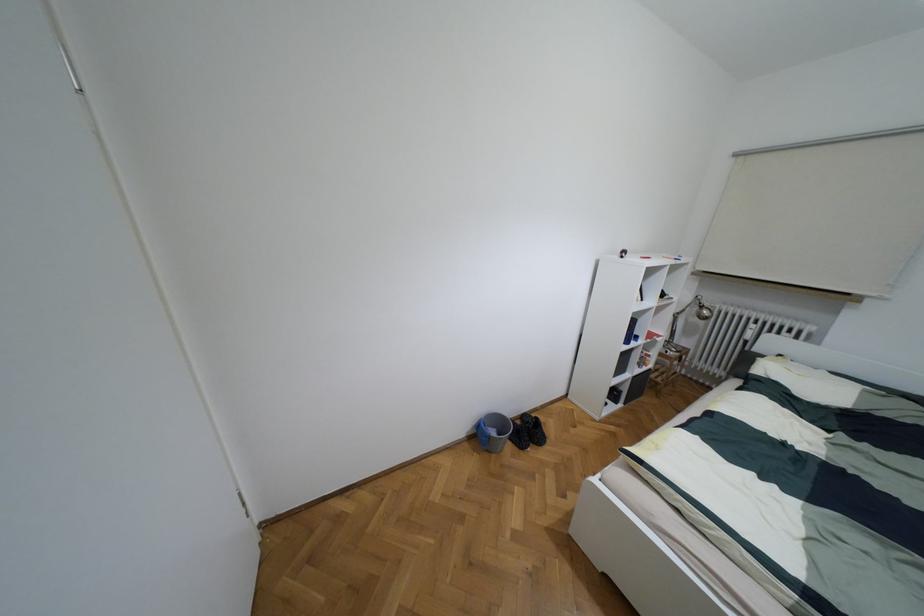
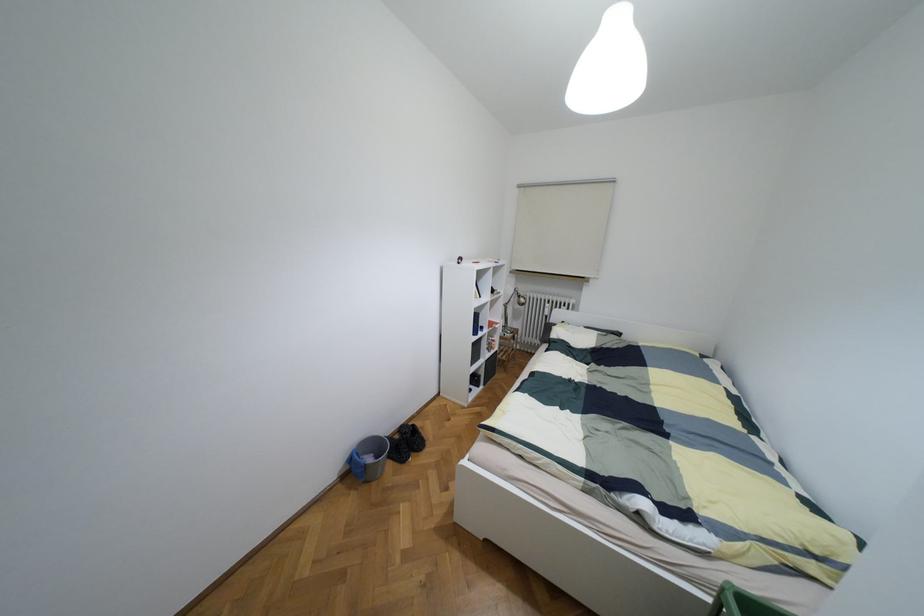
Question: The images are taken continuously from a first-person perspective. In which direction is your viewpoint rotating?

Choices:
 (A) Left
 (B) Right
 (C) Up
 (D) Down

Answer: (B)